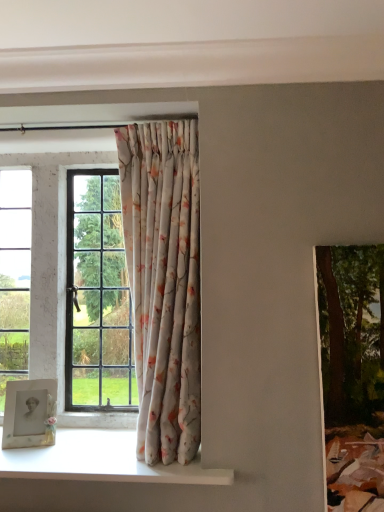
The width and height of the screenshot is (384, 512). Identify the location of free space above white glossy window sill at lower left (from a real-world perspective). point(86,450).